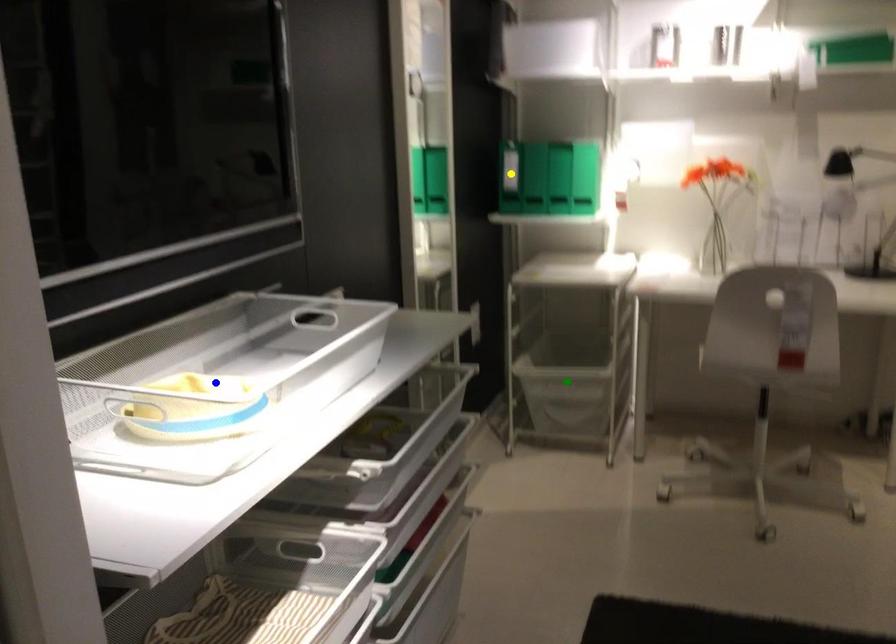
Order these from nearest to farthest:
- yellow point
- green point
- blue point

1. blue point
2. green point
3. yellow point